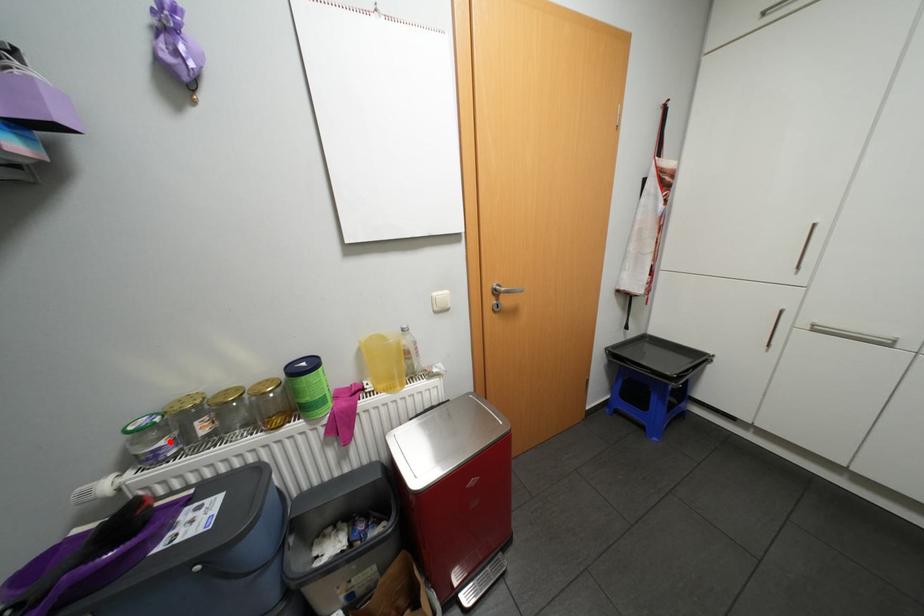
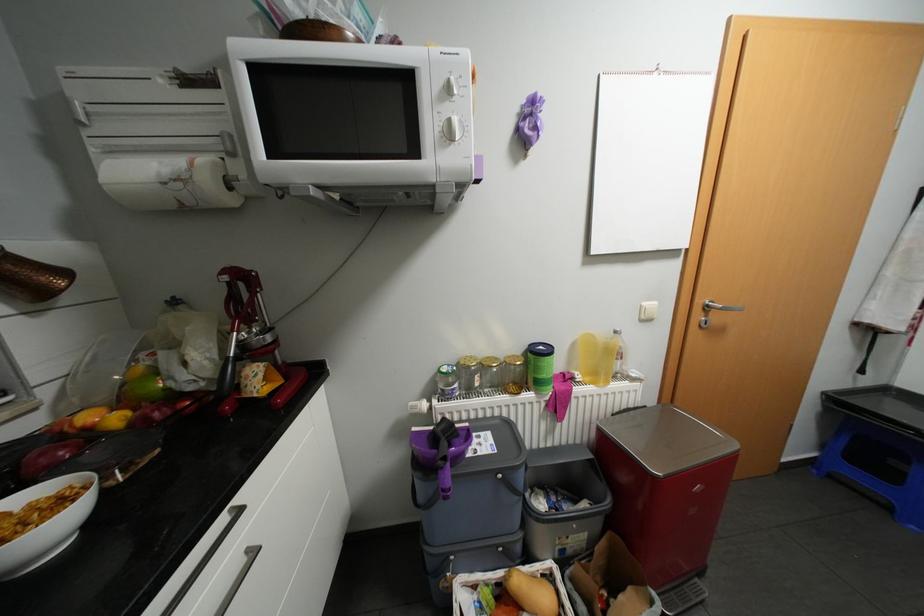
Where in the second image is the point corresponding to the highlighted location from the first image?

(464, 384)